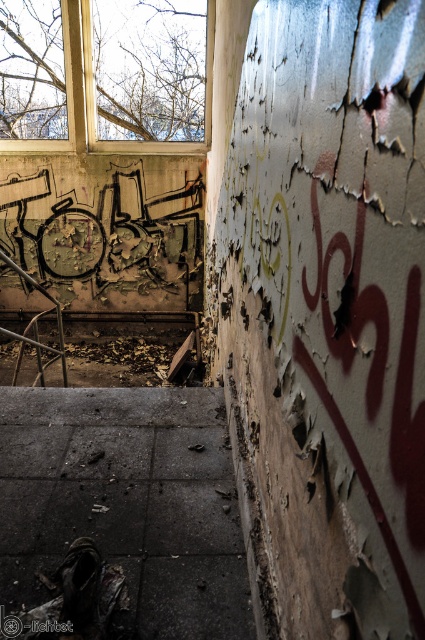
Question: Can you confirm if wooden frame window at upper left is wider than rusty metal staircase at lower left?

Choices:
 (A) no
 (B) yes

Answer: (A)

Question: Observing the image, what is the correct spatial positioning of wooden frame window at upper left in reference to rusty metal staircase at lower left?

Choices:
 (A) below
 (B) above

Answer: (B)

Question: Among these points, which one is nearest to the camera?

Choices:
 (A) (112, 150)
 (B) (104, 380)

Answer: (B)

Question: Among these points, which one is farthest from the camera?

Choices:
 (A) (113, 323)
 (B) (57, 416)
 (C) (82, 136)

Answer: (A)

Question: Among these points, which one is nearest to the camera?

Choices:
 (A) (184, 525)
 (B) (166, 378)

Answer: (A)

Question: Does dark concrete stairs at center have a greater width compared to rusty metal staircase at lower left?

Choices:
 (A) yes
 (B) no

Answer: (B)